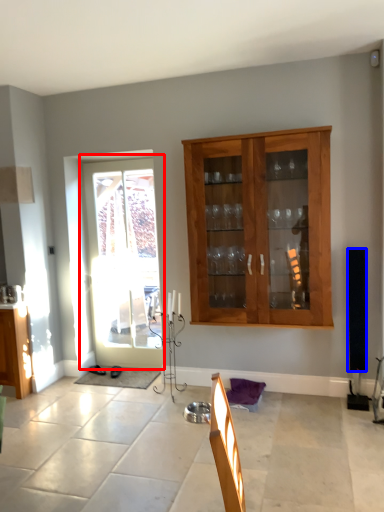
Question: Which point is further to the camera, door (highlighted by a red box) or loudspeaker (highlighted by a blue box)?

Choices:
 (A) door
 (B) loudspeaker

Answer: (A)